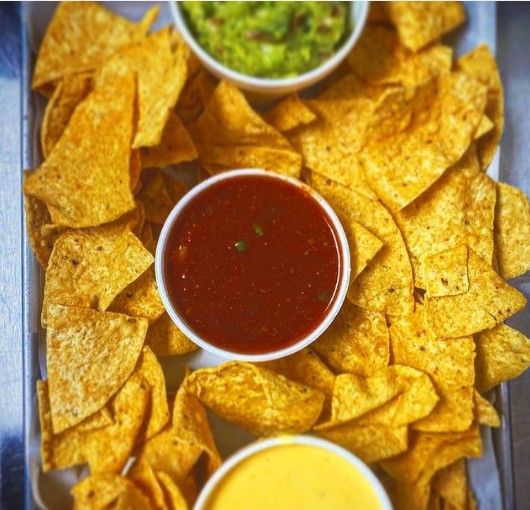
You are a GUI agent. You are given a task and a screenshot of the screen. Output one action in this format:
    pyautogui.click(x=<x>, y=<y>)
    Task: Click on the metal tray
    The image size is (530, 510).
    Given the screenshot: What is the action you would take?
    pyautogui.click(x=35, y=349)